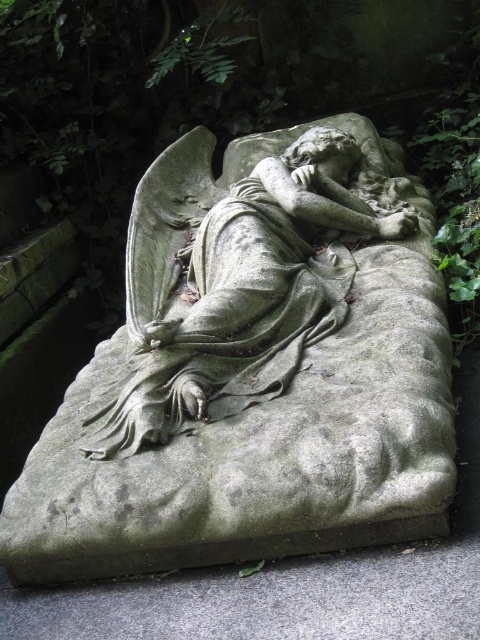
Is gray stone angel at center wider than gray stone bench at lower center?

In fact, gray stone angel at center might be narrower than gray stone bench at lower center.

Who is positioned more to the left, gray stone angel at center or gray stone bench at lower center?

From the viewer's perspective, gray stone bench at lower center appears more on the left side.

Identify the location of gray stone angel at center. This screenshot has width=480, height=640. (248, 292).